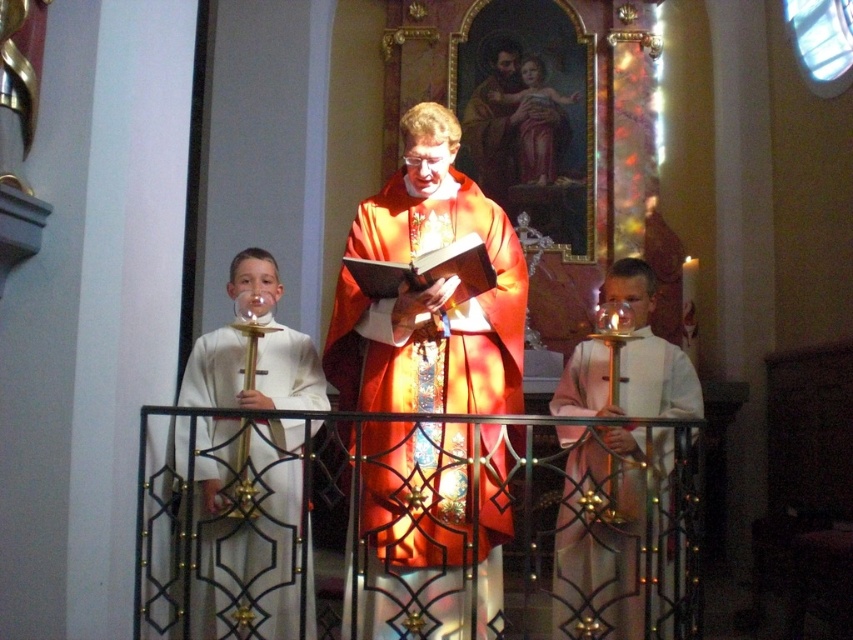
Question: Is the position of shiny orange robe at center more distant than that of white satin robe at left?

Choices:
 (A) yes
 (B) no

Answer: (A)

Question: Based on their relative distances, which object is farther from the white satin robe at left?

Choices:
 (A) matte gold statue at upper center
 (B) pink satin robe at right

Answer: (A)

Question: Which point appears closest to the camera in this image?

Choices:
 (A) (567, 568)
 (B) (421, 356)
 (C) (531, 76)
 (D) (262, 513)

Answer: (D)

Question: Considering the real-world distances, which object is farthest from the pink satin robe at right?

Choices:
 (A) matte gold statue at upper center
 (B) shiny orange robe at center
 (C) white satin robe at left

Answer: (A)

Question: Can you confirm if shiny orange robe at center is thinner than matte gold statue at upper center?

Choices:
 (A) no
 (B) yes

Answer: (A)

Question: Can you confirm if white satin robe at left is positioned to the left of pink satin robe at right?

Choices:
 (A) yes
 (B) no

Answer: (A)